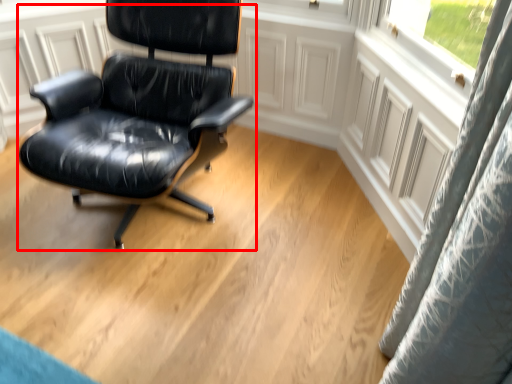
Question: From the image's perspective, considering the relative positions of chair (annotated by the red box) and curtain in the image provided, where is chair (annotated by the red box) located with respect to the staircase?

Choices:
 (A) below
 (B) above

Answer: (B)